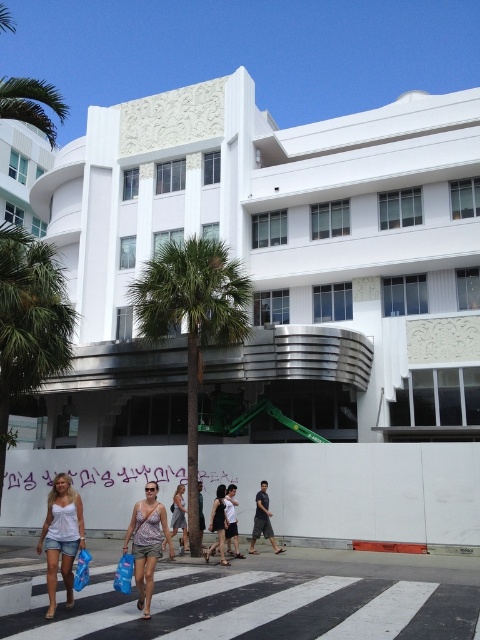
Question: Observing the image, what is the correct spatial positioning of white cotton tank top at lower left in reference to black dress at center?

Choices:
 (A) right
 (B) left

Answer: (B)

Question: Does printed fabric tank top at center appear on the right side of white cotton shirt at center?

Choices:
 (A) no
 (B) yes

Answer: (A)

Question: Among these points, which one is nearest to the camera?

Choices:
 (A) (3, 422)
 (B) (133, 545)

Answer: (B)

Question: Where is gray cotton shirt at center located in relation to blue fabric bag at lower center in the image?

Choices:
 (A) right
 (B) left

Answer: (A)

Question: Which of the following is the closest to the observer?

Choices:
 (A) green leafy palm tree at left
 (B) gray cotton shirt at center
 (C) black dress at center

Answer: (C)

Question: Which point is farther to the camera?

Choices:
 (A) green leafy palm tree at left
 (B) blue fabric shopping bag at lower left

Answer: (A)